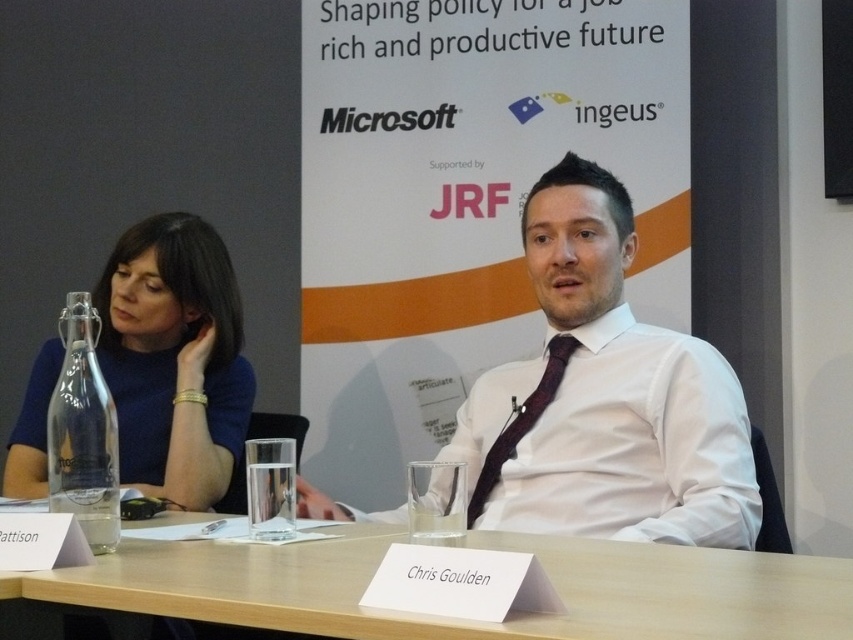
Question: Among these objects, which one is nearest to the camera?

Choices:
 (A) white shirt at center
 (B) matte glass bottle at left
 (C) maroon satin tie at center
 (D) light wood table at center

Answer: (D)

Question: Can you confirm if light wood table at center is bigger than maroon satin tie at center?

Choices:
 (A) no
 (B) yes

Answer: (B)

Question: Which point is farther to the camera?

Choices:
 (A) clear glass bottle at left
 (B) light wood table at center
 (C) white shirt at center
 (D) maroon satin tie at center

Answer: (D)

Question: Can you confirm if white shirt at center is thinner than maroon satin tie at center?

Choices:
 (A) yes
 (B) no

Answer: (B)

Question: Estimate the real-world distances between objects in this image. Which object is farther from the white shirt at center?

Choices:
 (A) light wood table at center
 (B) matte glass bottle at left

Answer: (B)

Question: Where is white shirt at center located in relation to matte glass bottle at left in the image?

Choices:
 (A) below
 (B) above

Answer: (A)